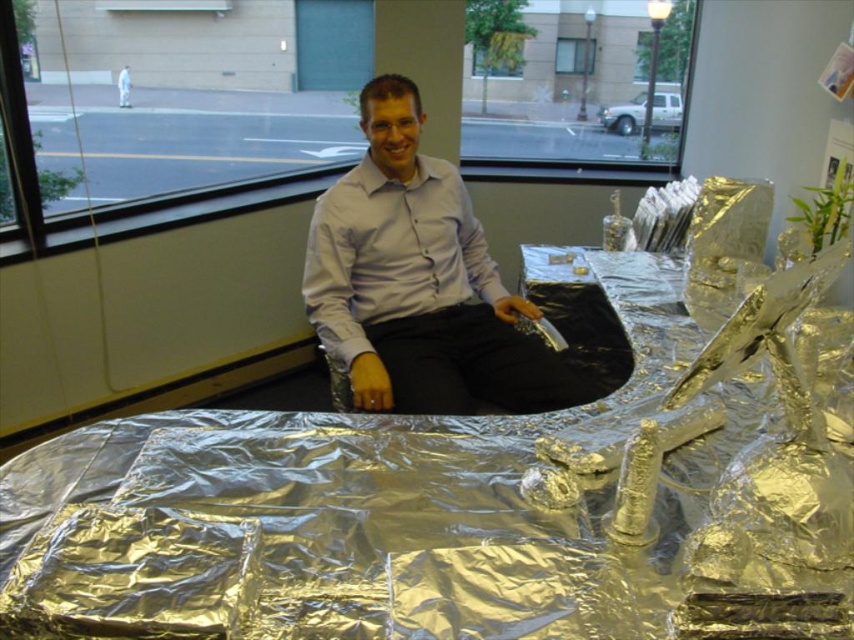
This screenshot has width=854, height=640. In order to click on silver reflective table at center in this screenshot , I will do `click(457, 508)`.

Looking at this image, who is positioned more to the left, silver reflective table at center or matte white shirt at center?

matte white shirt at center

Who is more distant from viewer, [504,445] or [360,202]?

Positioned behind is point [360,202].

Find the location of a particular element. The width and height of the screenshot is (854, 640). silver reflective table at center is located at coordinates (457, 508).